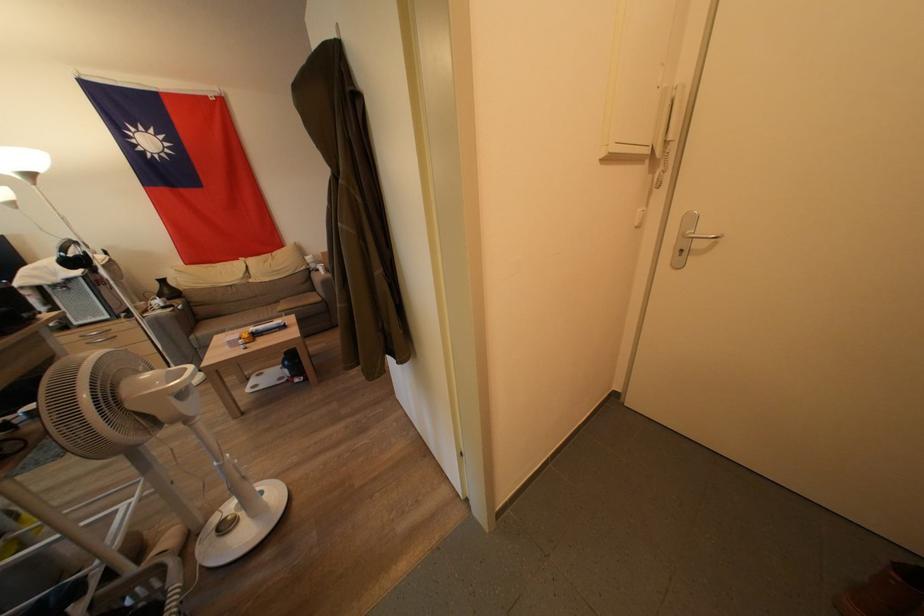
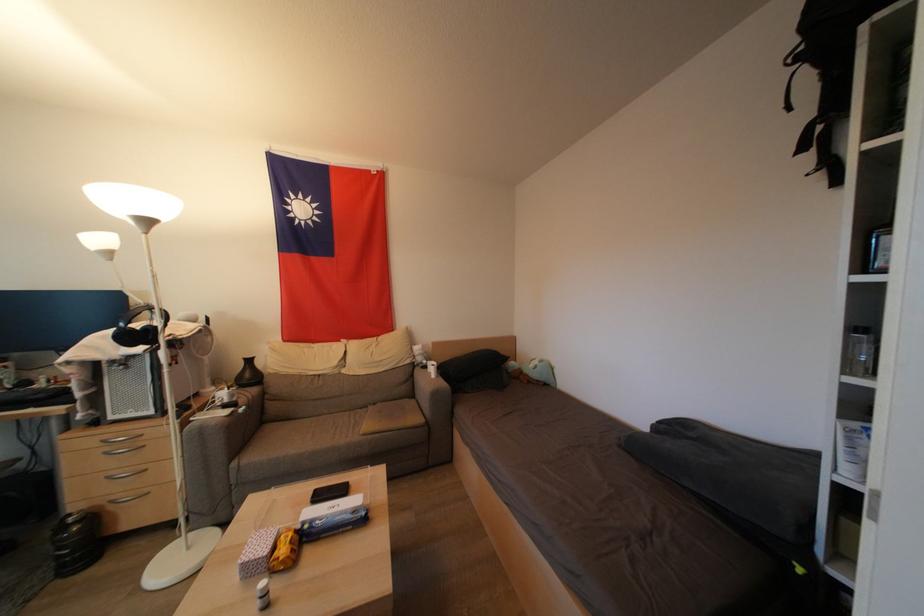
What movement of the cameraman would produce the second image?

The movement direction of the cameraman is left, forward.